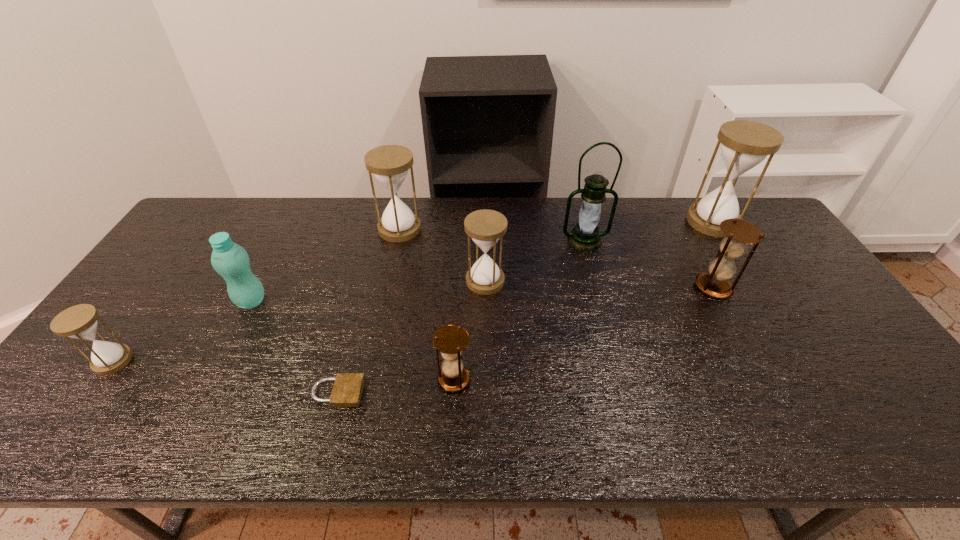
You are a GUI agent. You are given a task and a screenshot of the screen. Output one action in this format:
    pyautogui.click(x=<x>, y=<y>)
    Task: Click on the unoccupied position between the second object from left to right and the padlock
    This screenshot has height=540, width=960.
    Given the screenshot: What is the action you would take?
    pos(295,347)

At what (x,y) coordinates should I click in order to perform the action: click on free space between the bigger brown hourglass and the leftmost object. Please return your answer as a coordinate pair (x, y). The image size is (960, 540). Looking at the image, I should click on (414, 324).

The width and height of the screenshot is (960, 540). In order to click on free spot between the green lantern and the smaller brown hourglass in this screenshot , I will do `click(519, 309)`.

Where is `the eighth closest object to the fifth hourglass from right to left`? The image size is (960, 540). the eighth closest object to the fifth hourglass from right to left is located at coordinates (745, 144).

Locate an element on the screen. Image resolution: width=960 pixels, height=540 pixels. object that is the third closest to the tallest hourglass is located at coordinates (485, 227).

Select which hourglass appears as the third closest to the rightmost white hourglass. Please provide its 2D coordinates. Your answer should be formatted as a tuple, i.e. [(x, y)], where the tuple contains the x and y coordinates of a point satisfying the conditions above.

[(451, 340)]

In order to click on hourglass that is the closest one to the right brown hourglass in this screenshot , I will do `click(745, 144)`.

In order to click on the fourth closest white hourglass to the left brown hourglass in this screenshot , I will do `click(745, 144)`.

Locate an element on the screen. white hourglass that is the second closest to the nearest white hourglass is located at coordinates (485, 227).

In order to click on free location that satisfies the following two spatial constraints: 1. on the back side of the bottle; 2. on the right side of the biggest white hourglass in this screenshot , I will do `click(292, 221)`.